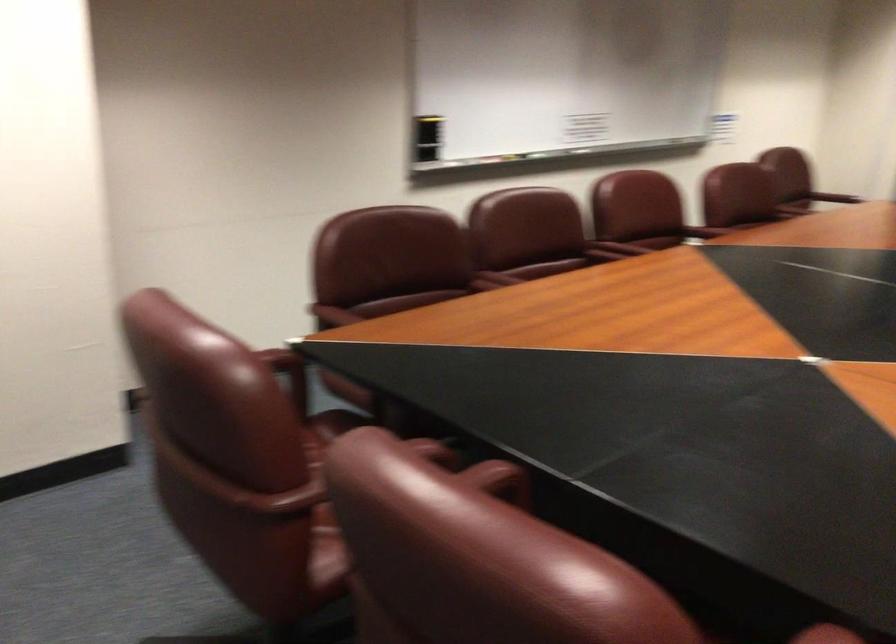
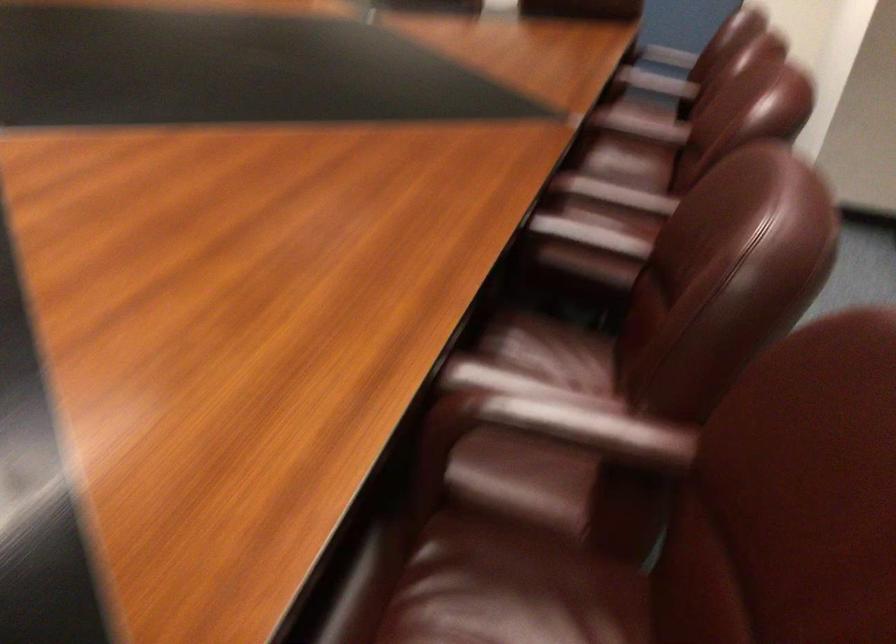
Find the pixel in the second image that matches point 719,218 in the first image.

(613, 194)